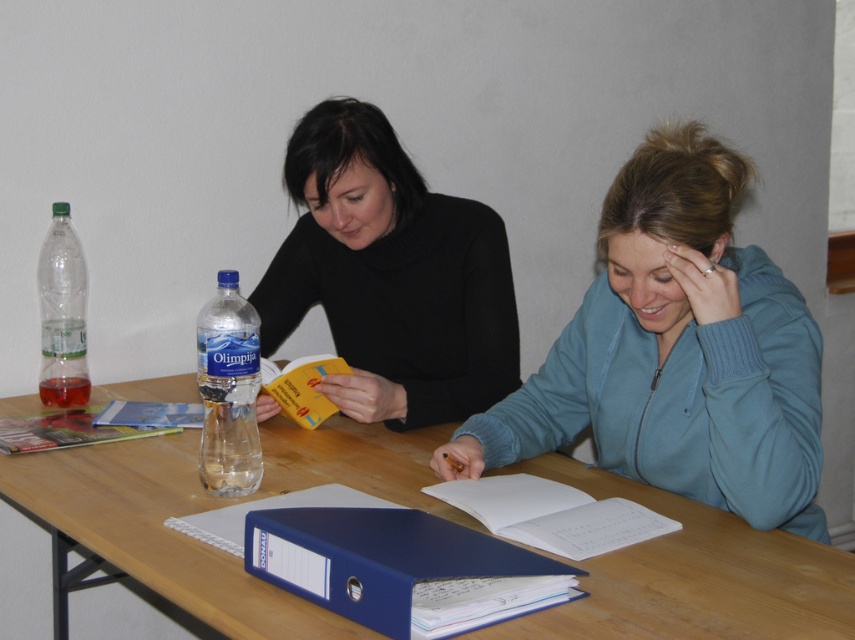
Question: Is blue fleece jacket at center right thinner than matte plastic book at left?

Choices:
 (A) no
 (B) yes

Answer: (A)

Question: Does blue plastic binder at center have a greater width compared to white paper book at center?

Choices:
 (A) no
 (B) yes

Answer: (B)

Question: Among these objects, which one is nearest to the camera?

Choices:
 (A) clear plastic bottle at center
 (B) matte plastic book at left
 (C) wooden table at center
 (D) yellow paper at center

Answer: (C)

Question: Which object appears closest to the camera in this image?

Choices:
 (A) black matte sweater at upper left
 (B) blue matte book at center
 (C) white paper book at center

Answer: (C)

Question: Which point is closer to the camera taking this photo?

Choices:
 (A) (214, 336)
 (B) (332, 621)
 (C) (80, 358)
 (D) (423, 545)

Answer: (B)

Question: Does blue plastic binder at center lie in front of clear plastic bottle at center?

Choices:
 (A) yes
 (B) no

Answer: (A)